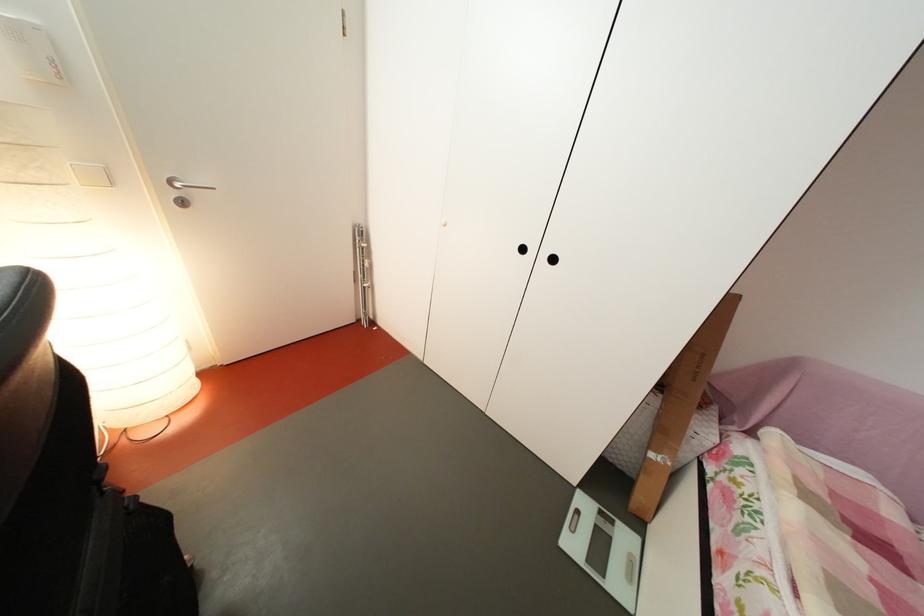
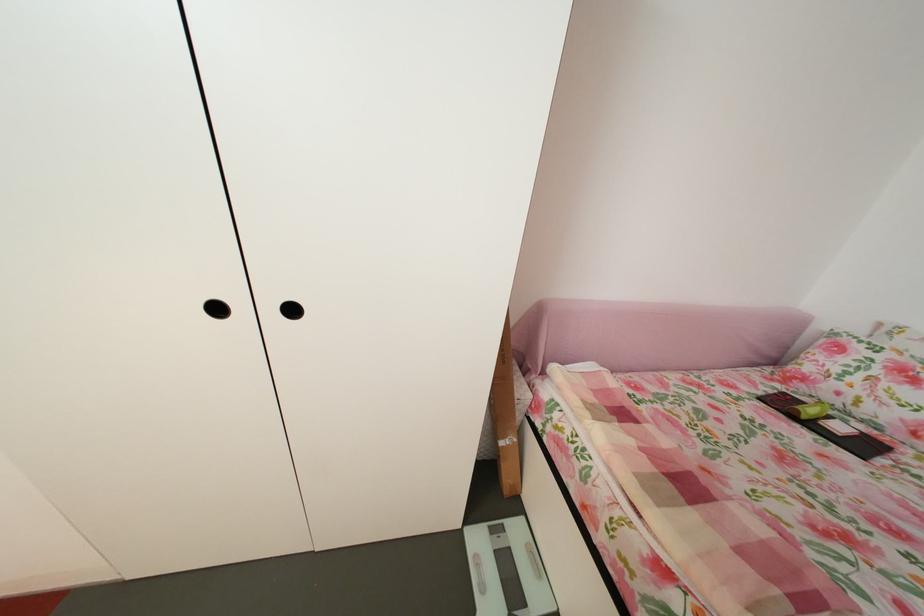
Locate, in the second image, the point that corresponds to the point at 747,426 in the first image.

(541, 371)